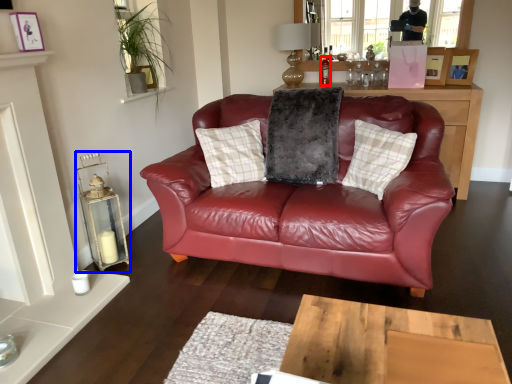
Question: Which of the following is the farthest to the observer, bottle (highlighted by a red box) or candle holder (highlighted by a blue box)?

Choices:
 (A) bottle
 (B) candle holder

Answer: (A)